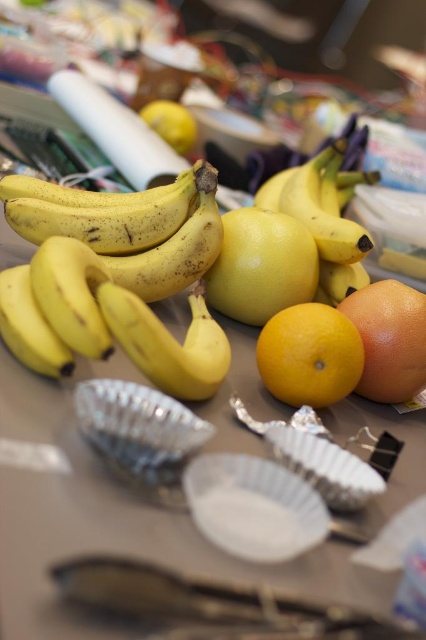
Is shiny metallic spoon at lower center taller than yellow matte lemon at center?

Incorrect, shiny metallic spoon at lower center's height is not larger of yellow matte lemon at center's.

Does shiny metallic spoon at lower center appear under yellow matte lemon at center?

Indeed, shiny metallic spoon at lower center is positioned under yellow matte lemon at center.

Is point (158, 609) positioned behind point (307, 284)?

No, (158, 609) is closer to viewer.

Find the location of a particular element. The width and height of the screenshot is (426, 640). shiny metallic spoon at lower center is located at coordinates [204, 600].

Is glossy orange at center shorter than yellow matte bananas at left?

No.

From the picture: Does glossy orange at center have a smaller size compared to yellow matte bananas at left?

Actually, glossy orange at center might be larger than yellow matte bananas at left.

Between point (403, 324) and point (28, 339), which one is positioned behind?

Point (403, 324)

I want to click on glossy orange at center, so tap(388, 339).

Is yellow matte bananas at upper left further to the viewer compared to yellow matte lemon at center?

No, it is in front of yellow matte lemon at center.

The width and height of the screenshot is (426, 640). Identify the location of yellow matte bananas at upper left. (127, 227).

Is point (161, 243) farther from camera compared to point (259, 214)?

No, it is in front of (259, 214).

Where is `yellow matte bananas at upper left`? yellow matte bananas at upper left is located at coordinates (127, 227).